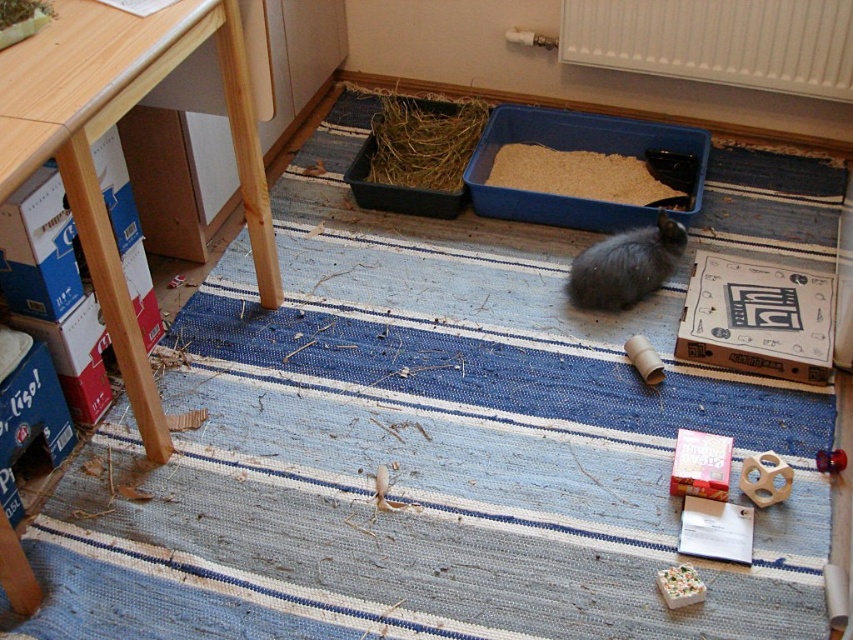
You are a small animal, like a rabbit, and you want to reach the brown shredded hay at center. Based on the scene description, where exactly is the brown shredded hay located in the image?

The brown shredded hay at center is located at point coordinates of 0.273 on the x axis and 0.676 on the y axis.

You are a pet owner who just noticed your cat is near the blue plastic litter box at center and the fluffy gray cat at center. Which one is closer to the left side of the image?

The blue plastic litter box at center is to the left of the fluffy gray cat at center, so the blue plastic litter box at center is closer to the left side of the image.

You are a housekeeper entering the kitchen and notice the blue plastic litter box at center and the fluffy gray cat at center. Which object is positioned higher from the floor?

The blue plastic litter box at center is above the fluffy gray cat at center, so it is higher from the floor.